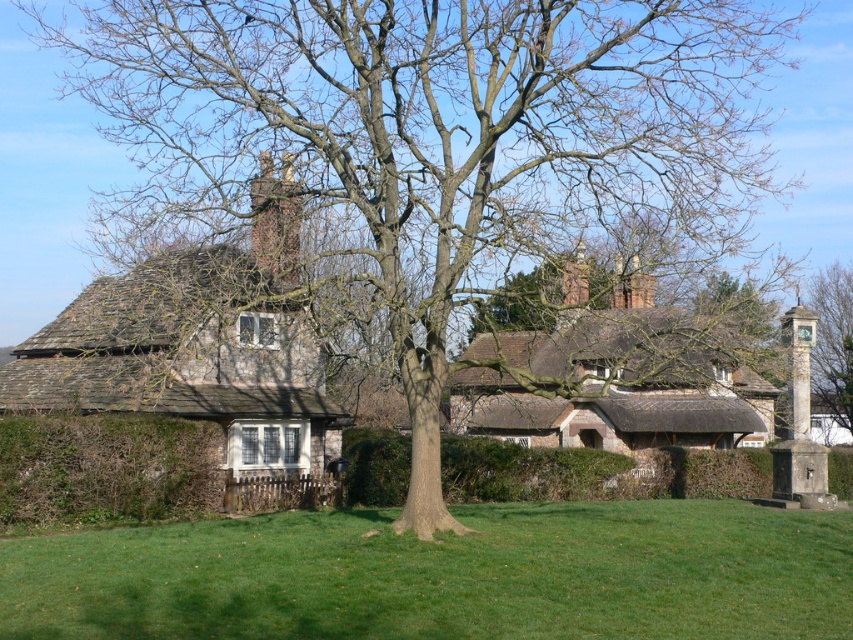
You are standing at a viewpoint 150 feet away from the traditional stone house with a thatched roof. You want to walk towards the point marked at coordinates point (306, 440). How much closer will you be to the point after walking straight towards it?

The point (306, 440) is 105.96 feet away from the viewer. If you walk straight towards it from 150 feet away, you will be 150 feet minus 105.96 feet, which equals 44.04 feet closer to the point.